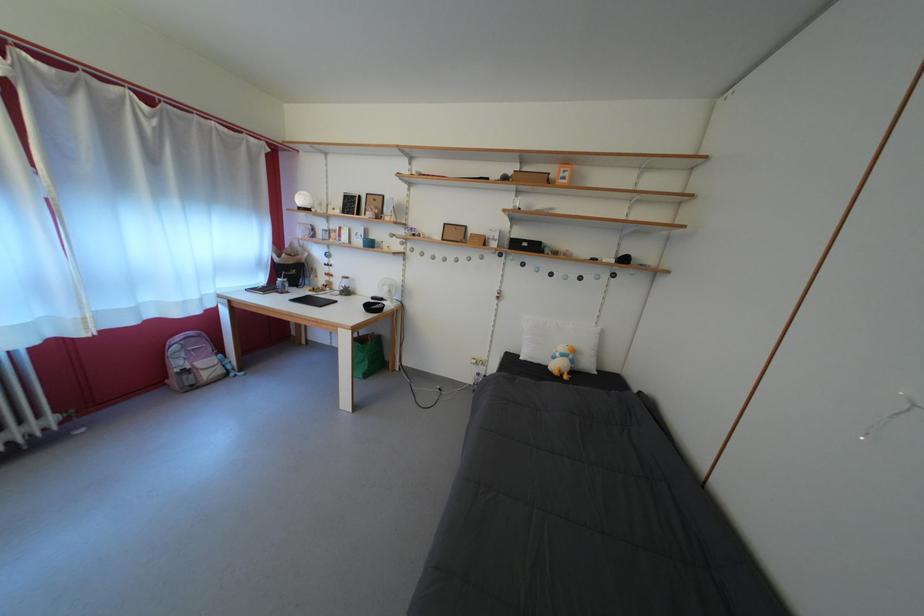
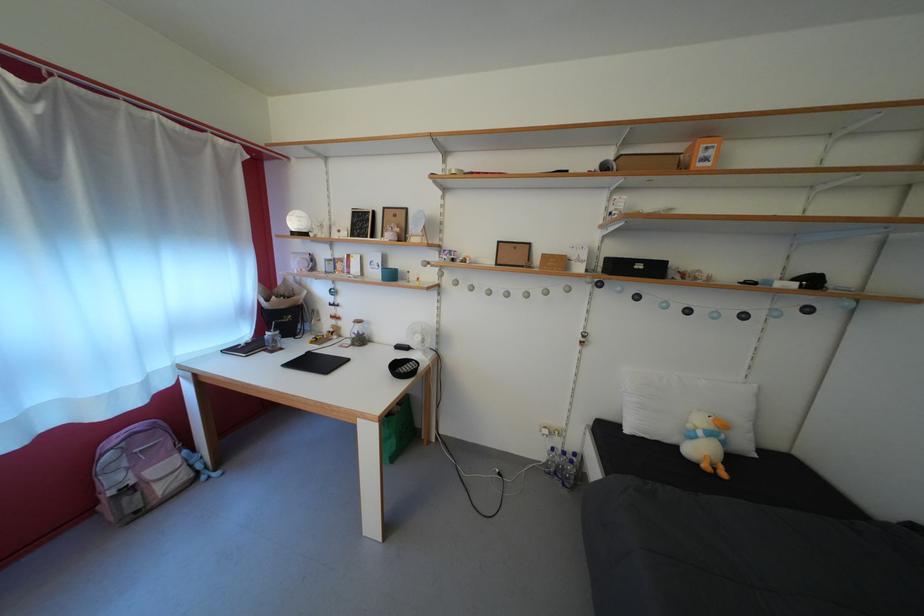
Locate, in the second image, the point that corresponds to point (187, 370) in the first image.

(123, 485)